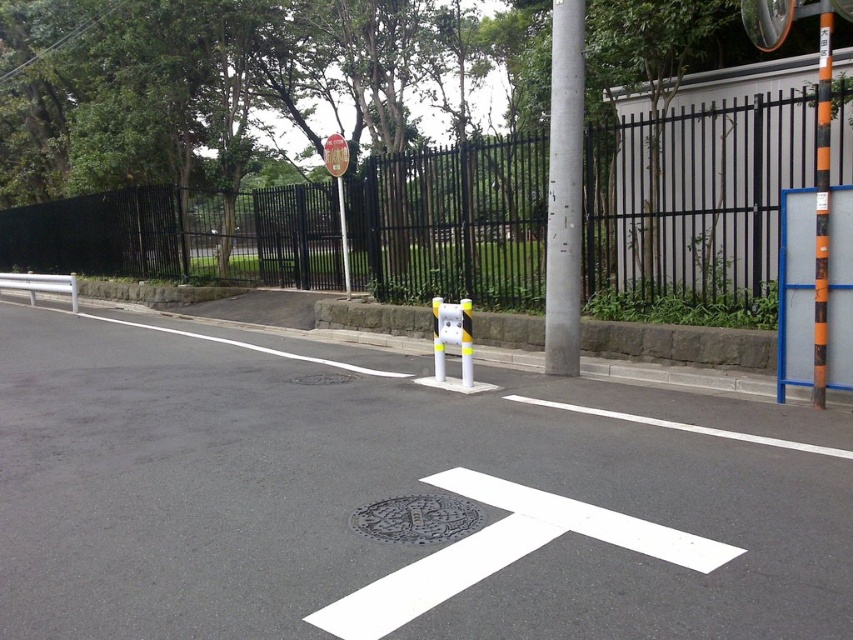
Question: Which object is the farthest from the metallic yellow traffic sign at upper center?

Choices:
 (A) orange/black striped pole at right
 (B) metallic reflective sign at upper center
 (C) silver metallic pole at upper center
 (D) black metal fence at center

Answer: (A)

Question: Does black metal fence at center appear under metallic pole at center?

Choices:
 (A) no
 (B) yes

Answer: (A)

Question: Can you confirm if black metal fence at center is positioned to the left of metallic reflective sign at upper center?

Choices:
 (A) no
 (B) yes

Answer: (B)

Question: Which object is the farthest from the black metal fence at center?

Choices:
 (A) metallic pole at center
 (B) metallic yellow traffic sign at upper center

Answer: (B)

Question: Which object is positioned farthest from the metallic pole at center?

Choices:
 (A) black metal fence at center
 (B) metallic yellow traffic sign at upper center

Answer: (A)

Question: Observing the image, what is the correct spatial positioning of black metal fence at center in reference to orange/black striped pole at right?

Choices:
 (A) right
 (B) left

Answer: (B)